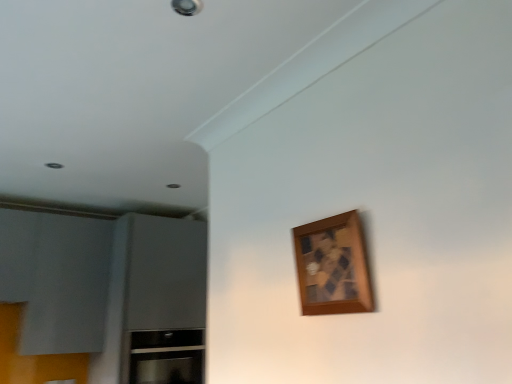
Question: Is wooden picture frame at upper right taller than satin silver cabinet at lower left?

Choices:
 (A) no
 (B) yes

Answer: (A)

Question: From a real-world perspective, does wooden picture frame at upper right sit lower than satin silver cabinet at lower left?

Choices:
 (A) yes
 (B) no

Answer: (B)

Question: Is wooden picture frame at upper right turned away from satin silver cabinet at lower left?

Choices:
 (A) yes
 (B) no

Answer: (B)

Question: From the image's perspective, does wooden picture frame at upper right appear lower than satin silver cabinet at lower left?

Choices:
 (A) yes
 (B) no

Answer: (B)

Question: Can you confirm if wooden picture frame at upper right is positioned to the left of satin silver cabinet at lower left?

Choices:
 (A) no
 (B) yes

Answer: (A)

Question: Is wooden picture frame at upper right further to the viewer compared to satin silver cabinet at lower left?

Choices:
 (A) yes
 (B) no

Answer: (B)

Question: Considering the relative sizes of satin silver cabinet at lower left and wooden picture frame at upper right in the image provided, is satin silver cabinet at lower left smaller than wooden picture frame at upper right?

Choices:
 (A) no
 (B) yes

Answer: (A)

Question: Is satin silver cabinet at lower left positioned behind wooden picture frame at upper right?

Choices:
 (A) no
 (B) yes

Answer: (B)

Question: Is wooden picture frame at upper right completely or partially inside satin silver cabinet at lower left?

Choices:
 (A) yes
 (B) no

Answer: (B)

Question: Can you confirm if satin silver cabinet at lower left is bigger than wooden picture frame at upper right?

Choices:
 (A) no
 (B) yes

Answer: (B)

Question: Does satin silver cabinet at lower left have a greater width compared to wooden picture frame at upper right?

Choices:
 (A) no
 (B) yes

Answer: (B)

Question: Can you confirm if satin silver cabinet at lower left is positioned to the left of wooden picture frame at upper right?

Choices:
 (A) no
 (B) yes

Answer: (B)

Question: Would you say wooden picture frame at upper right is inside or outside satin silver cabinet at lower left?

Choices:
 (A) inside
 (B) outside

Answer: (B)